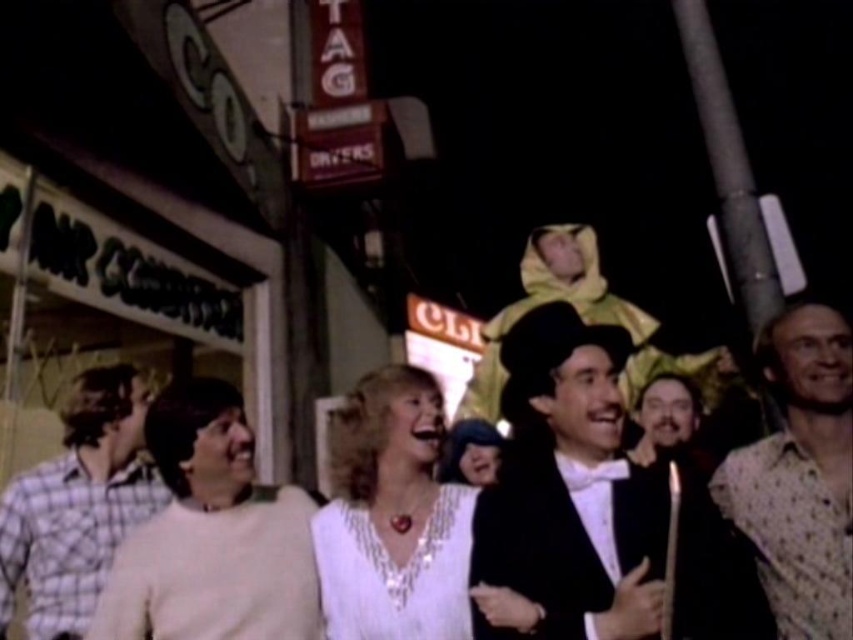
Question: Which point is closer to the camera taking this photo?

Choices:
 (A) (474, 477)
 (B) (643, 433)

Answer: (A)

Question: Does white satin blouse at center appear under plaid cotton shirt at left?

Choices:
 (A) no
 (B) yes

Answer: (A)

Question: Estimate the real-world distances between objects in this image. Which object is farther from the black satin tuxedo at center?

Choices:
 (A) plaid cotton shirt at left
 (B) bearded man at center
 (C) white satin blouse at center

Answer: (A)

Question: Which point is farther to the camera?

Choices:
 (A) (160, 548)
 (B) (839, 401)
 (C) (457, 428)
 (D) (556, 593)

Answer: (C)

Question: Does white satin blouse at center appear on the right side of plaid cotton shirt at left?

Choices:
 (A) no
 (B) yes

Answer: (B)

Question: Can you confirm if white cotton sweater at center is positioned below white dotted shirt at right?

Choices:
 (A) yes
 (B) no

Answer: (A)